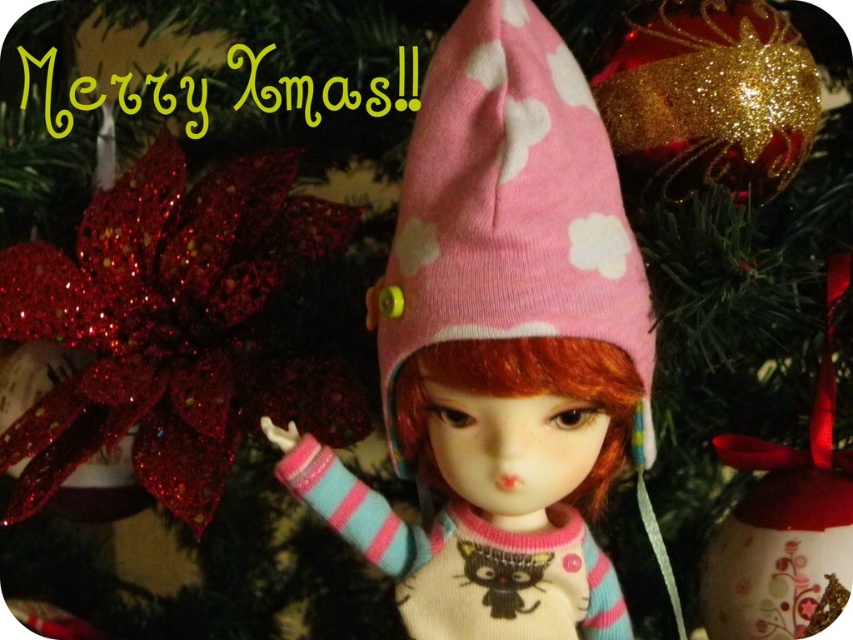
The image size is (853, 640). What do you see at coordinates (173, 326) in the screenshot?
I see `sparkly red flower at left` at bounding box center [173, 326].

This screenshot has width=853, height=640. Identify the location of sparkly red flower at left. (173, 326).